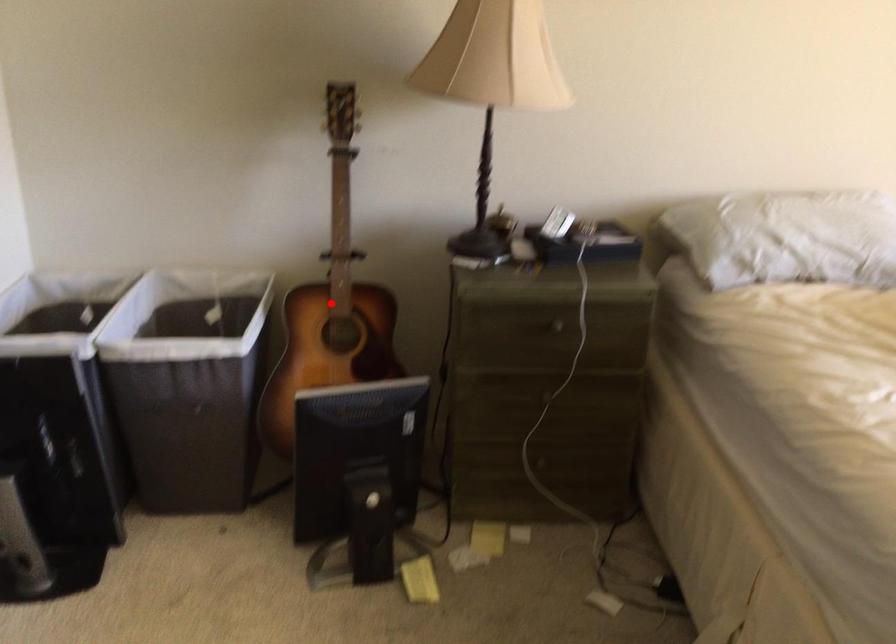
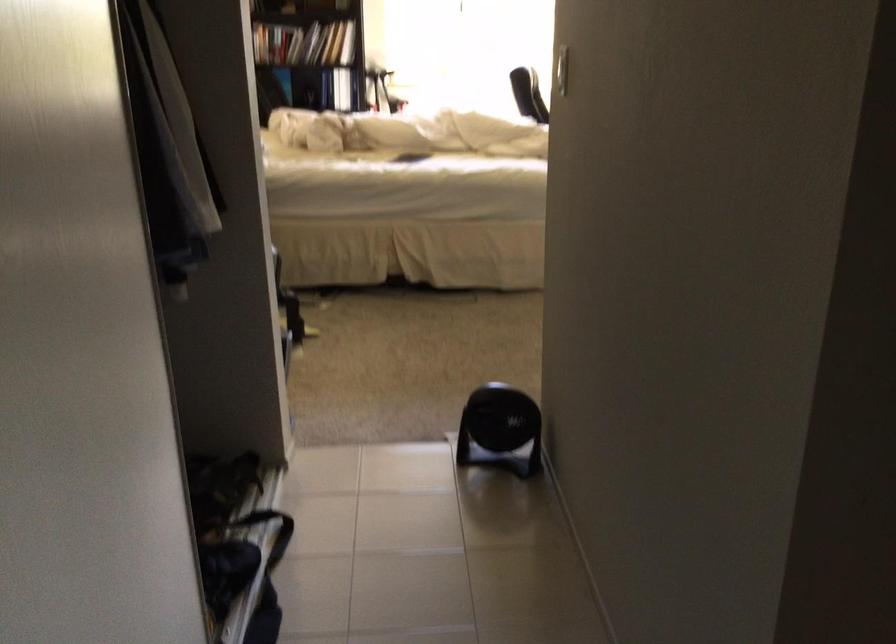
Question: I am providing you with two images of the same scene from different viewpoints. A red point is marked on the first image. Is the red point's position out of view in image 2?

Choices:
 (A) Yes
 (B) No

Answer: (A)